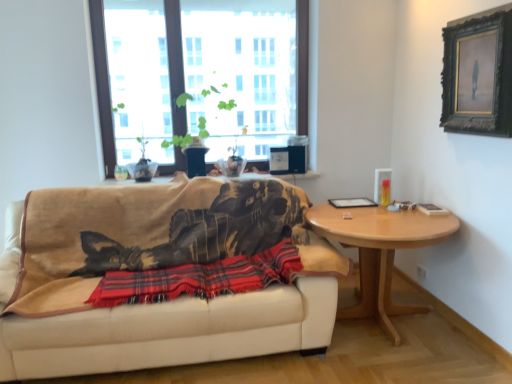
Question: Looking at their shapes, would you say green matte plant at upper center is wider or thinner than beige fabric couch at center?

Choices:
 (A) thin
 (B) wide

Answer: (A)

Question: Considering the relative positions of green matte plant at upper center and beige fabric couch at center in the image provided, is green matte plant at upper center to the left or to the right of beige fabric couch at center?

Choices:
 (A) left
 (B) right

Answer: (B)

Question: Estimate the real-world distances between objects in this image. Which object is farther from the light brown wooden table at right?

Choices:
 (A) black wooden picture frame at upper right
 (B) beige fabric couch at center
 (C) green matte plant at upper center
 (D) transparent glass window at upper center
 (E) red plaid blanket at center

Answer: (C)

Question: Estimate the real-world distances between objects in this image. Which object is closer to the transparent glass window at upper center?

Choices:
 (A) red plaid blanket at center
 (B) black wooden picture frame at upper right
 (C) light brown wooden table at right
 (D) green matte plant at upper center
 (E) beige fabric couch at center

Answer: (D)